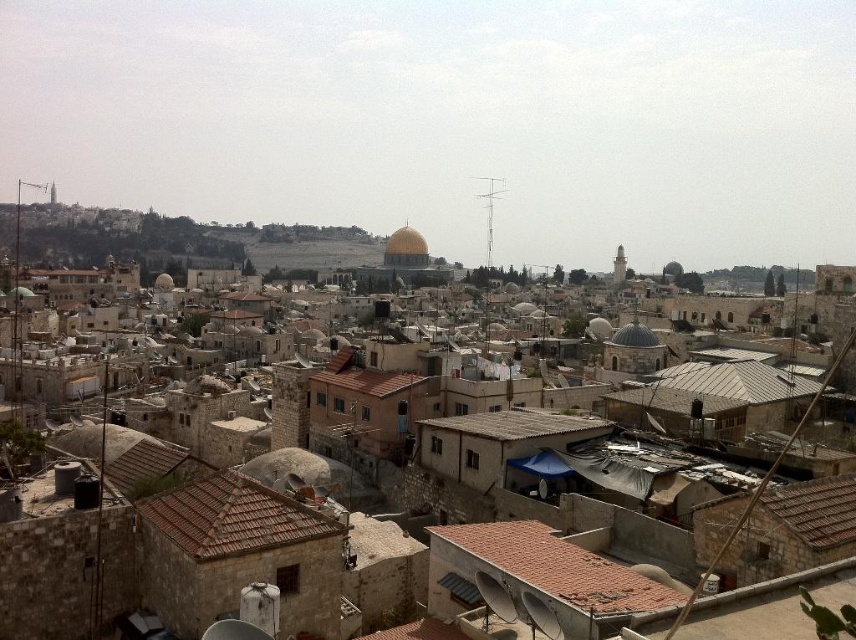
Is brown tile roof at lower left shorter than golden stone dome at center?

Yes, brown tile roof at lower left is shorter than golden stone dome at center.

Is point (247, 552) closer to camera compared to point (399, 252)?

Yes, it is.

Where is `brown tile roof at lower left`? The height and width of the screenshot is (640, 856). brown tile roof at lower left is located at coordinates (230, 516).

Which is behind, point (528, 428) or point (413, 378)?

Positioned behind is point (413, 378).

Which is more to the right, brown textured roof at center or brown tile roof at center?

brown textured roof at center

Identify the location of brown textured roof at center. (514, 422).

Consider the image. Who is more forward, (522, 529) or (351, 392)?

Point (522, 529) is in front.

Between point (464, 529) and point (403, 385), which one is positioned behind?

Positioned behind is point (403, 385).

Does point (565, 536) come behind point (361, 360)?

No, it is not.

Where is `brown tiled roof at lower center`? The image size is (856, 640). brown tiled roof at lower center is located at coordinates (535, 572).